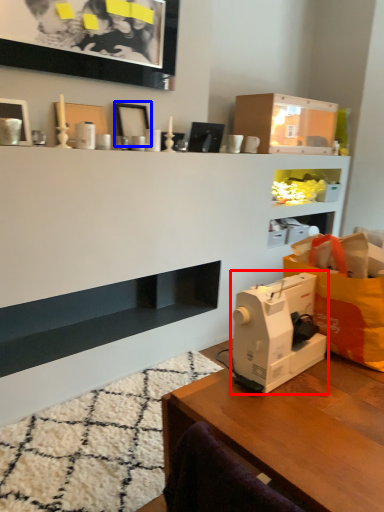
Question: Which of the following is the closest to the observer, sewing machine (highlighted by a red box) or picture frame (highlighted by a blue box)?

Choices:
 (A) sewing machine
 (B) picture frame

Answer: (A)